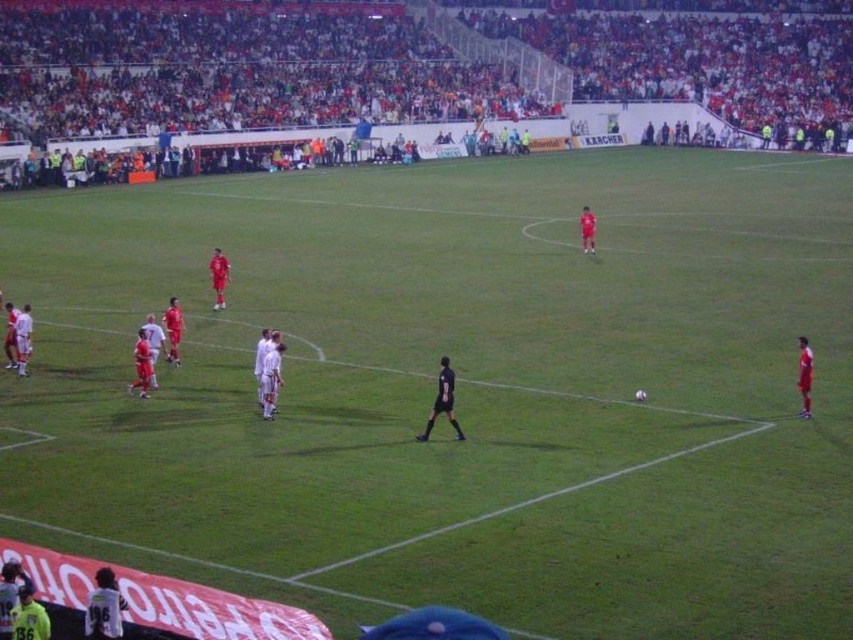
Question: Which object is farther from the camera taking this photo?

Choices:
 (A) white jersey at lower left
 (B) pink matte soccer player at center
 (C) white jersey at left
 (D) matte red shorts at lower left

Answer: (B)

Question: Among these points, which one is farthest from the camera?

Choices:
 (A) (28, 337)
 (B) (103, 588)

Answer: (A)

Question: Which point is closer to the camera taking this photo?

Choices:
 (A) (22, 308)
 (B) (579, 221)

Answer: (A)

Question: Does white jersey at left appear on the left side of matte red shorts at lower left?

Choices:
 (A) no
 (B) yes

Answer: (B)

Question: Does matte red jersey at lower left appear on the left side of pink matte soccer player at center?

Choices:
 (A) no
 (B) yes

Answer: (B)

Question: Is black matte referee at center bigger than matte red soccer player at center?

Choices:
 (A) no
 (B) yes

Answer: (B)